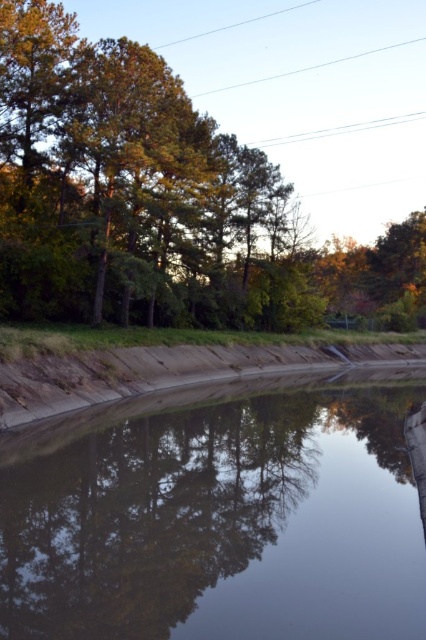
Question: Is smooth reflective water at center bigger than green leafy tree at upper left?

Choices:
 (A) no
 (B) yes

Answer: (A)

Question: Which of the following is the farthest from the observer?

Choices:
 (A) (221, 189)
 (B) (244, 508)

Answer: (A)

Question: Is smooth reflective water at center smaller than green leafy tree at upper left?

Choices:
 (A) yes
 (B) no

Answer: (A)

Question: Which of the following is the closest to the observer?

Choices:
 (A) (132, 248)
 (B) (196, 442)

Answer: (B)

Question: Can you confirm if smooth reflective water at center is bigger than green leafy tree at upper left?

Choices:
 (A) no
 (B) yes

Answer: (A)